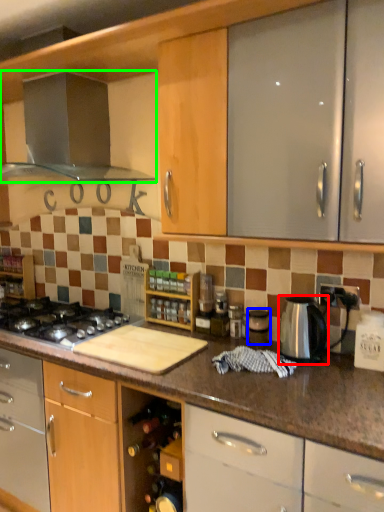
Question: Based on their relative distances, which object is farther from kitchen appliance (highlighted by a red box)? Choose from appliance (highlighted by a blue box) and kitchen appliance (highlighted by a green box).

Choices:
 (A) appliance
 (B) kitchen appliance

Answer: (B)